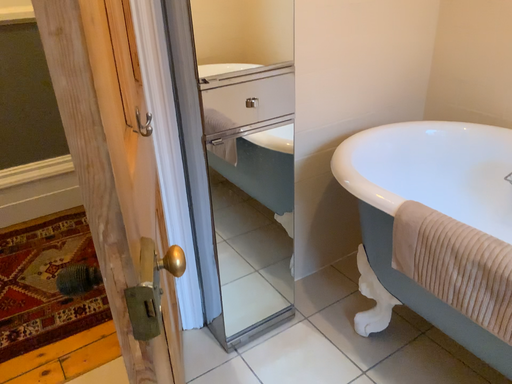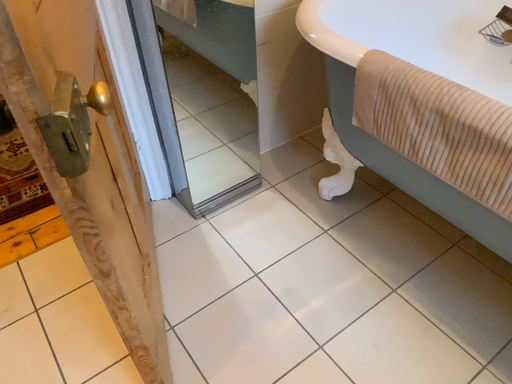
Question: How did the camera likely rotate when shooting the video?

Choices:
 (A) rotated downward
 (B) rotated upward

Answer: (A)